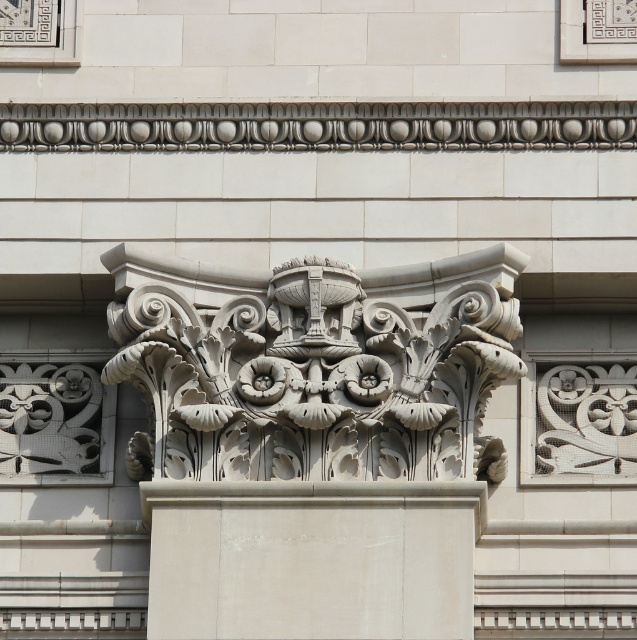
Question: Among these points, which one is nearest to the camera?

Choices:
 (A) (276, 570)
 (B) (162, 381)

Answer: (A)

Question: Observing the image, what is the correct spatial positioning of white stone column capital at center in reference to white stone column at center?

Choices:
 (A) left
 (B) right

Answer: (B)

Question: Does white stone column capital at center have a lesser width compared to white stone column at center?

Choices:
 (A) no
 (B) yes

Answer: (A)

Question: Does white stone column capital at center lie in front of white stone column at center?

Choices:
 (A) yes
 (B) no

Answer: (B)